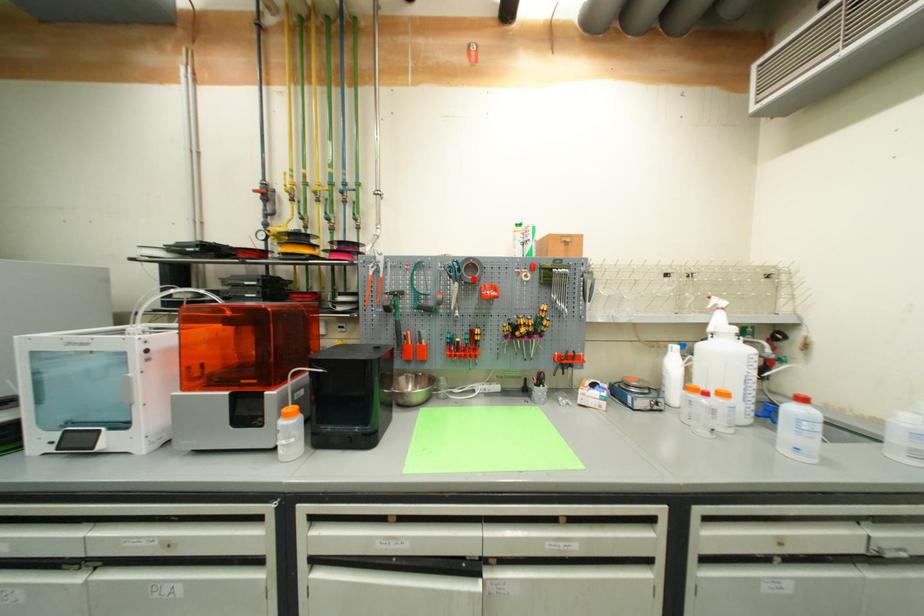
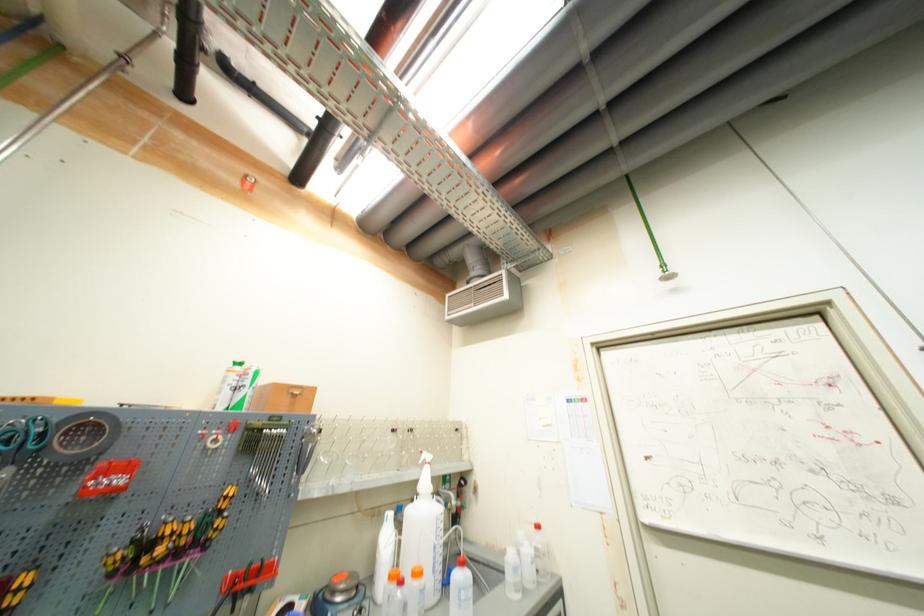
Find the pixel in the second image that matches the highlighted location in the first image.

(67, 453)